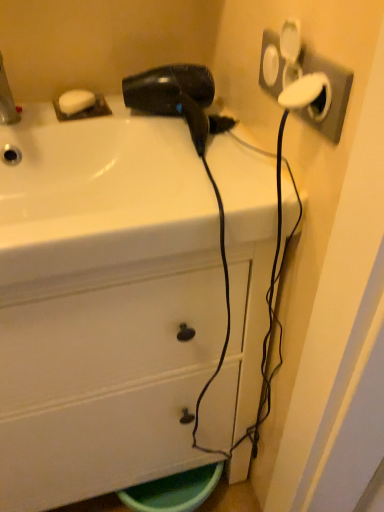
The width and height of the screenshot is (384, 512). Identify the location of free location to the left of white matte soap at upper left. (32, 113).